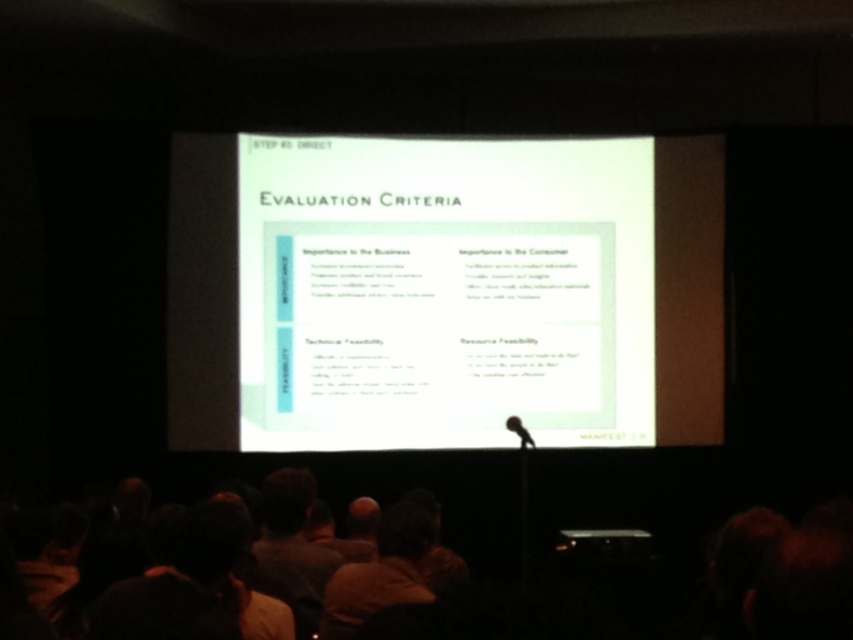
Question: Does white paper at center appear on the right side of brown hair at lower center?

Choices:
 (A) yes
 (B) no

Answer: (A)

Question: Which point is closer to the camera?

Choices:
 (A) (378, 541)
 (B) (376, 272)

Answer: (A)

Question: Which object is farther from the camera taking this photo?

Choices:
 (A) black matte microphone at center
 (B) white paper at center
 (C) brown hair at lower center

Answer: (B)

Question: Which of the following is the farthest from the observer?

Choices:
 (A) (416, 563)
 (B) (521, 424)

Answer: (B)

Question: Is white paper at center positioned at the back of brown hair at lower center?

Choices:
 (A) no
 (B) yes

Answer: (B)

Question: Observing the image, what is the correct spatial positioning of brown hair at lower center in reference to black matte microphone at center?

Choices:
 (A) right
 (B) left

Answer: (B)